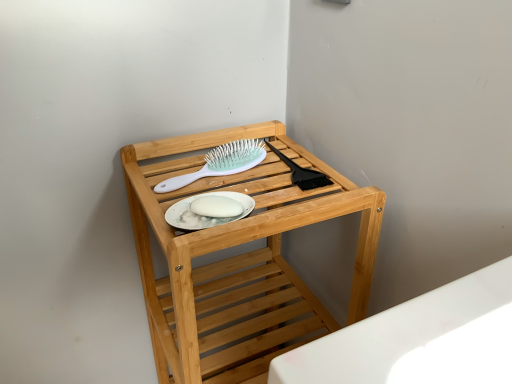
This screenshot has height=384, width=512. In order to click on vacant area on the back side of white plastic hairbrush at upper center in this screenshot , I will do `click(220, 142)`.